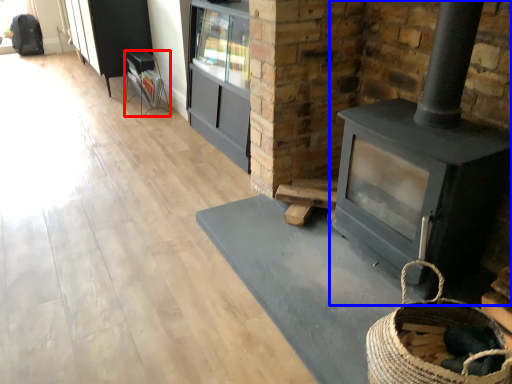
Question: Which point is closer to the camera, furniture (highlighted by a red box) or wood burning stove (highlighted by a blue box)?

Choices:
 (A) furniture
 (B) wood burning stove

Answer: (B)